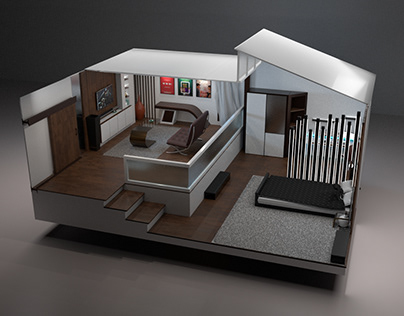
Find the location of a particular element. This screenshot has height=316, width=404. the top corner of curved white railing is located at coordinates (187, 164).